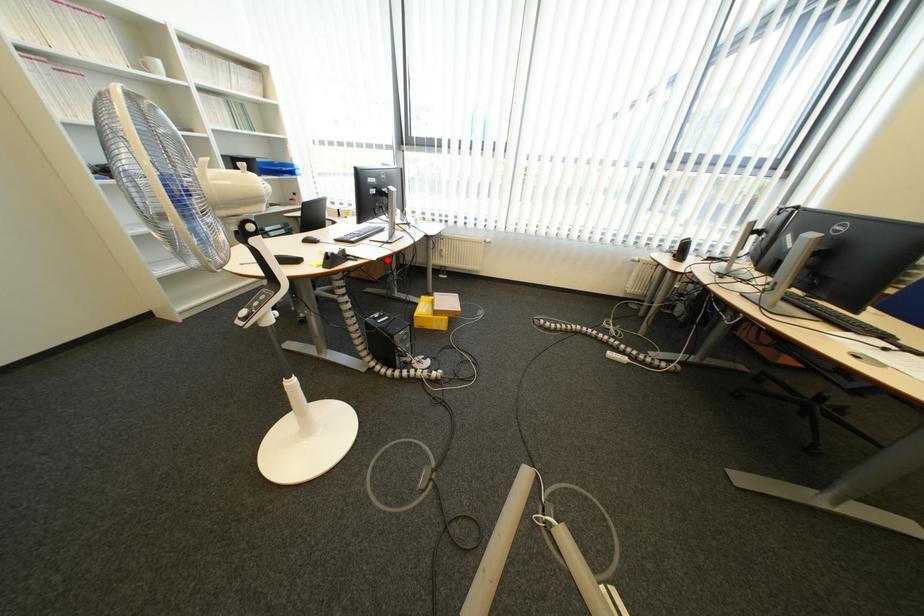
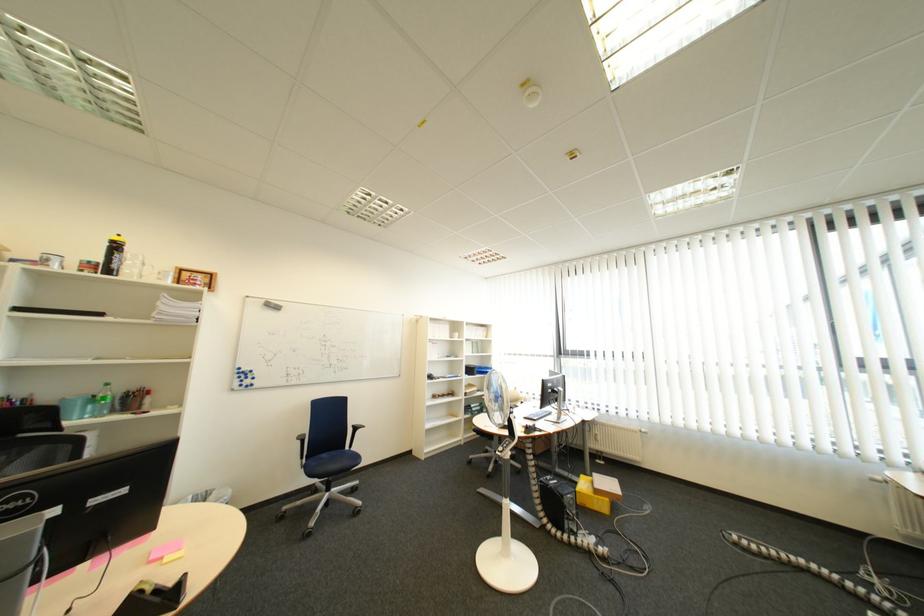
Where in the second image is the point corresponding to the highlighted location from the first image?

(565, 434)